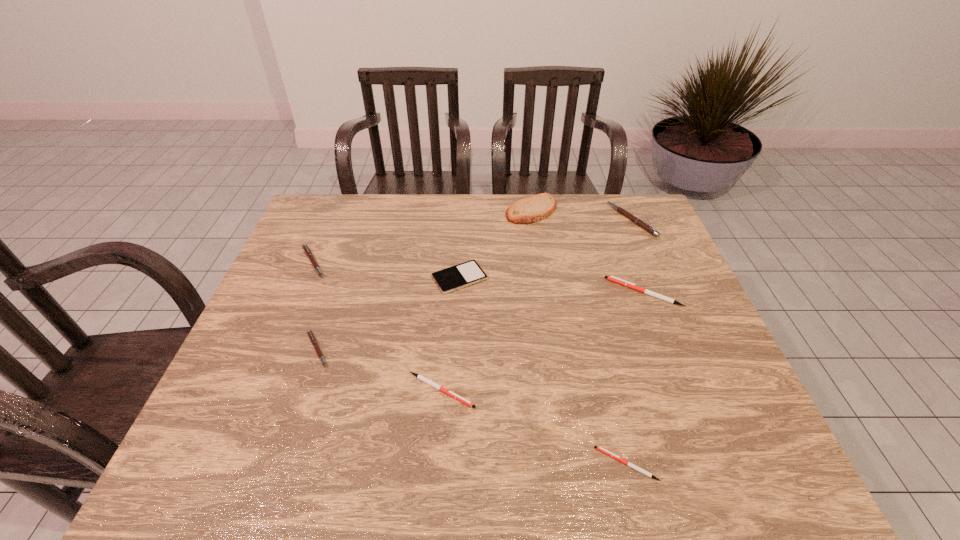
Where is `free space located 0.380m on the clicker of the rightmost white pen`? free space located 0.380m on the clicker of the rightmost white pen is located at coordinates (471, 292).

What are the coordinates of `free space located 0.220m on the clicker of the rightmost white pen` in the screenshot? It's located at (529, 292).

Where is `vacant point located on the left of the gray iPod`? This screenshot has height=540, width=960. vacant point located on the left of the gray iPod is located at coordinates (327, 278).

Image resolution: width=960 pixels, height=540 pixels. In order to click on free space located at the nib of the third nearest pen in this screenshot , I will do `click(366, 349)`.

You are a GUI agent. You are given a task and a screenshot of the screen. Output one action in this format:
    pyautogui.click(x=<x>, y=<y>)
    Task: Click on the free region located on the clicker of the second smallest white pen
    The width and height of the screenshot is (960, 540).
    Given the screenshot: What is the action you would take?
    pyautogui.click(x=649, y=390)

Identify the location of free space located 0.270m on the clicker of the nearest object. (461, 464).

The image size is (960, 540). What are the coordinates of `free spot located on the clicker of the nearest object` in the screenshot? It's located at coord(415,464).

Locate an element on the screen. This screenshot has height=540, width=960. vacant space situated 0.380m on the clicker of the nearest object is located at coordinates (405, 464).

Locate an element on the screen. The width and height of the screenshot is (960, 540). pita bread at the far edge is located at coordinates (534, 208).

Find the location of a particular element. This screenshot has height=540, width=960. pen that is at the far edge is located at coordinates click(639, 222).